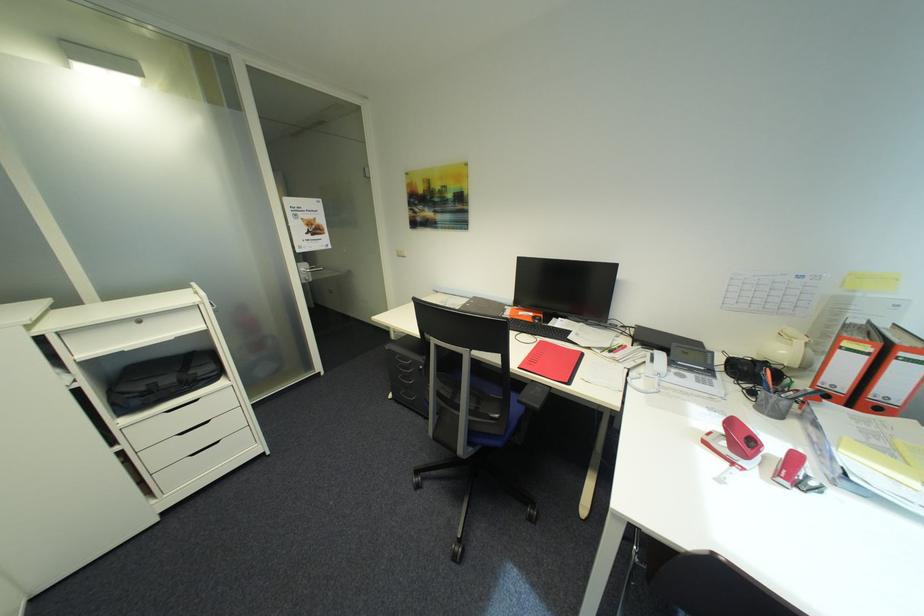
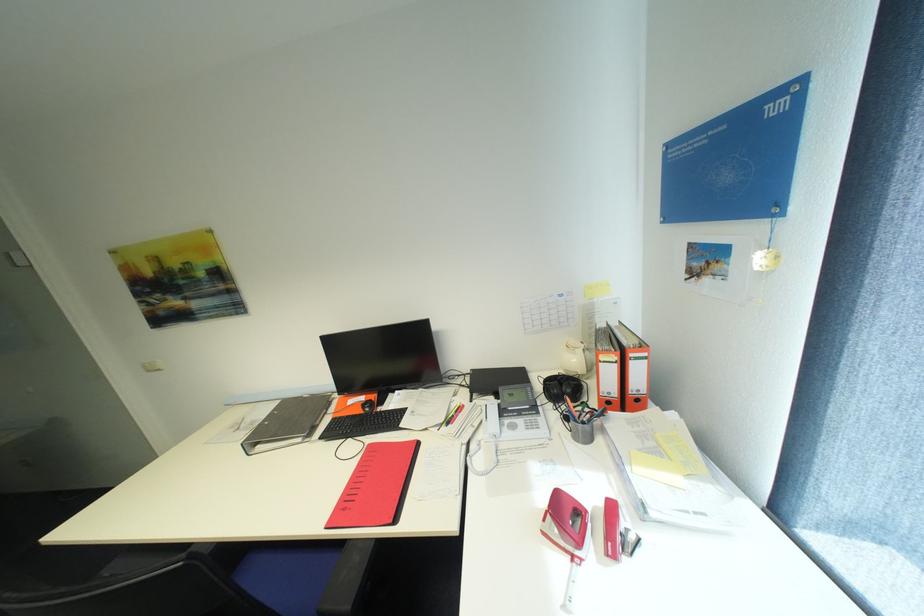
Question: The images are taken continuously from a first-person perspective. In which direction is your viewpoint rotating?

Choices:
 (A) Left
 (B) Right
 (C) Up
 (D) Down

Answer: (B)